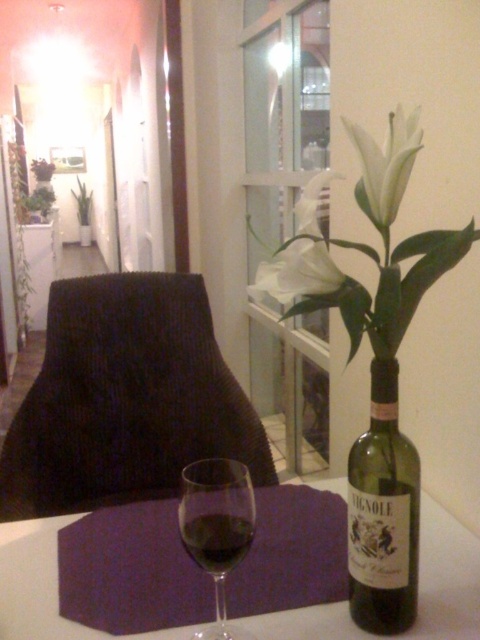
Image resolution: width=480 pixels, height=640 pixels. Describe the element at coordinates (364, 246) in the screenshot. I see `white matte flower at upper right` at that location.

Is point (299, 216) closer to viewer compared to point (362, 525)?

That is True.

You are a GUI agent. You are given a task and a screenshot of the screen. Output one action in this format:
    pyautogui.click(x=<x>, y=<y>)
    Task: Click on the white matte flower at upper right
    Image resolution: width=480 pixels, height=640 pixels.
    Given the screenshot: What is the action you would take?
    pyautogui.click(x=364, y=246)

Locate an element on the screen. The height and width of the screenshot is (640, 480). white matte flower at upper center is located at coordinates (297, 273).

This screenshot has height=640, width=480. Identify the location of white matte flower at upper center. (297, 273).

The width and height of the screenshot is (480, 640). What do you see at coordinates (383, 513) in the screenshot?
I see `green glass bottle at right` at bounding box center [383, 513].

Who is shorter, green glass bottle at right or white paper-like at upper center?

white paper-like at upper center is shorter.

Who is more forward, (416, 490) or (415, 140)?

Point (415, 140)

At what (x,y) coordinates should I click in order to perform the action: click on green glass bottle at right. Please return your answer as a coordinate pair (x, y). Looking at the image, I should click on (383, 513).